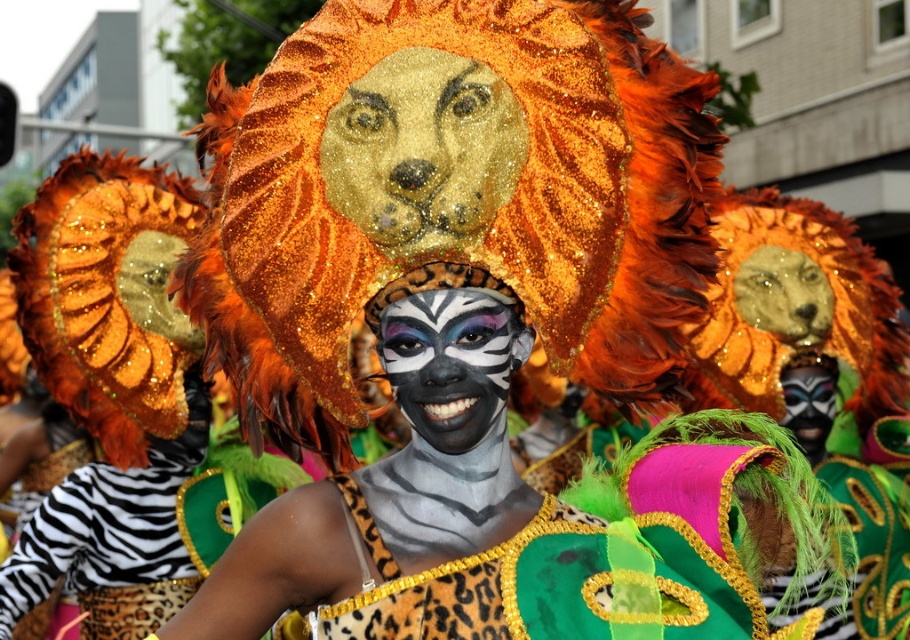
Consider the image. You are a photographer at the festival and want to capture the central figure. You notice a point at coordinates point (451, 360). Where is this point located on the central figure?

The point (451, 360) is located on the zebra striped face paint at center, which is part of the central figure.